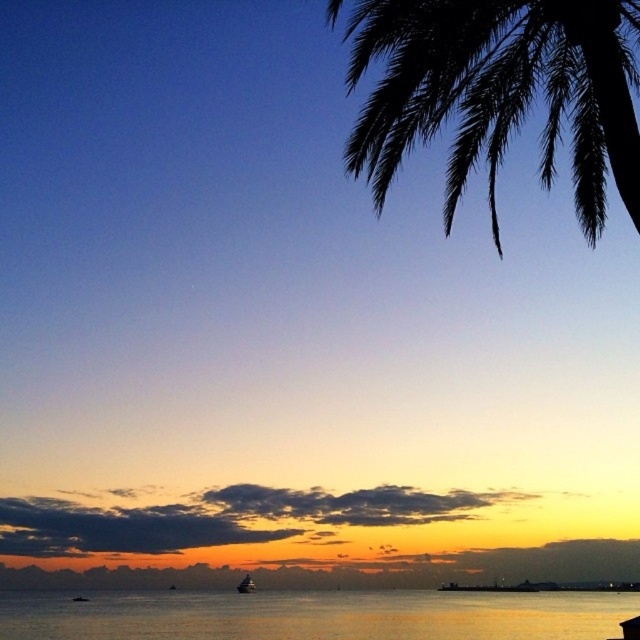
You are an artist trying to paint the sunset scene. You want to ensure the silvery reflective water at center and the smooth orange sky at lower center are positioned correctly. Based on the scene description, which object should be painted higher up in the painting?

The silvery reflective water at center should be painted higher up because it is located above the smooth orange sky at lower center.

You are an artist trying to paint the sunset scene. You want to ensure the silhouette leafy branch at upper right and the smooth orange sky at lower center are positioned correctly. Based on the scene, which object should appear closer to the viewer?

The silhouette leafy branch at upper right should appear closer to the viewer because it is in front of the smooth orange sky at lower center.

You are an observer looking at the sunset scene. You notice the smooth orange sky at lower center and the shiny silver boat at lower center. Which object appears closer to you?

The smooth orange sky at lower center appears closer to you because it is in front of the shiny silver boat at lower center.